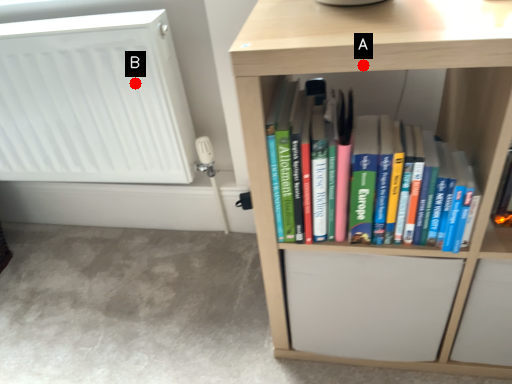
Question: Two points are circled on the image, labeled by A and B beside each circle. Which point appears farthest from the camera in this image?

Choices:
 (A) A is further
 (B) B is further

Answer: (B)